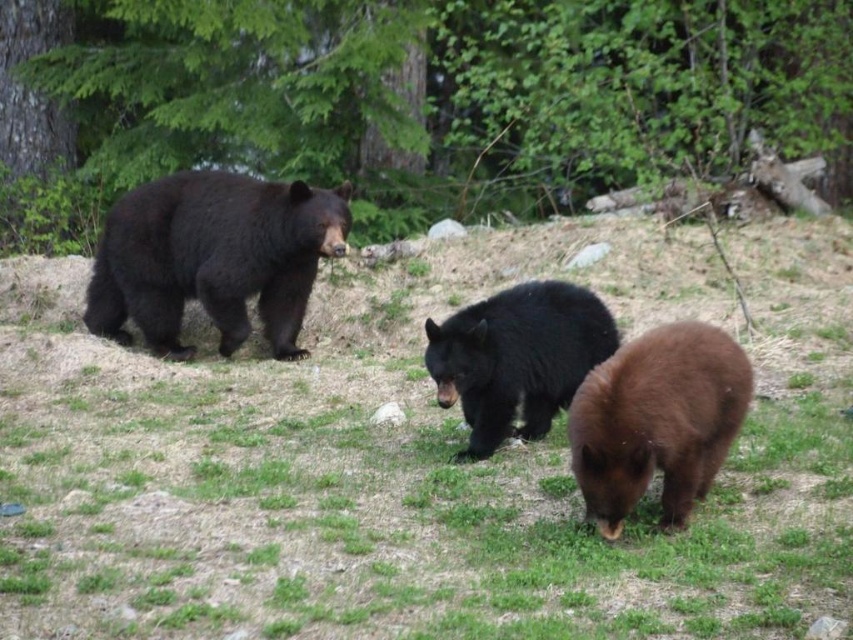
Question: Can you confirm if green leafy tree at upper center is bigger than shiny dark brown bear at left?

Choices:
 (A) no
 (B) yes

Answer: (A)

Question: Is green leafy tree at upper center bigger than brown furry bear at center?

Choices:
 (A) no
 (B) yes

Answer: (A)

Question: Which object is the closest to the brown furry bear at center?

Choices:
 (A) green grassy at upper center
 (B) shiny dark brown bear at left
 (C) green leafy tree at upper center
 (D) brown furry bear at lower right

Answer: (D)

Question: Which point is closer to the camera?

Choices:
 (A) shiny dark brown bear at left
 (B) brown furry bear at lower right

Answer: (B)

Question: Considering the real-world distances, which object is farthest from the brown furry bear at center?

Choices:
 (A) shiny dark brown bear at left
 (B) green grassy at upper center

Answer: (A)

Question: Is green leafy tree at upper center positioned in front of brown furry bear at lower right?

Choices:
 (A) no
 (B) yes

Answer: (A)